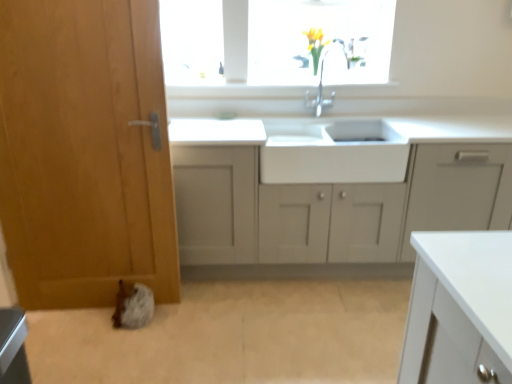
Question: Considering the positions of wooden door at left and white glossy sink at center in the image, is wooden door at left wider or thinner than white glossy sink at center?

Choices:
 (A) wide
 (B) thin

Answer: (B)

Question: Considering their positions, is wooden door at left located in front of or behind white glossy sink at center?

Choices:
 (A) front
 (B) behind

Answer: (A)

Question: Estimate the real-world distances between objects in this image. Which object is closer to the white glossy sink at center?

Choices:
 (A) white matte cabinet at center
 (B) wooden door at left

Answer: (A)

Question: Considering the real-world distances, which object is farthest from the white matte cabinet at center?

Choices:
 (A) wooden door at left
 (B) white glossy sink at center

Answer: (A)